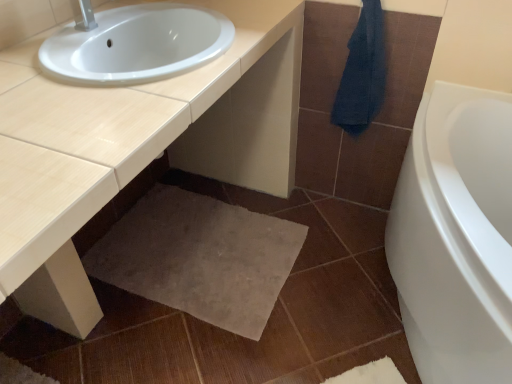
Where is `free space above beige glossy countertop at center (from a real-world perspective)`? The image size is (512, 384). free space above beige glossy countertop at center (from a real-world perspective) is located at coordinates (104, 96).